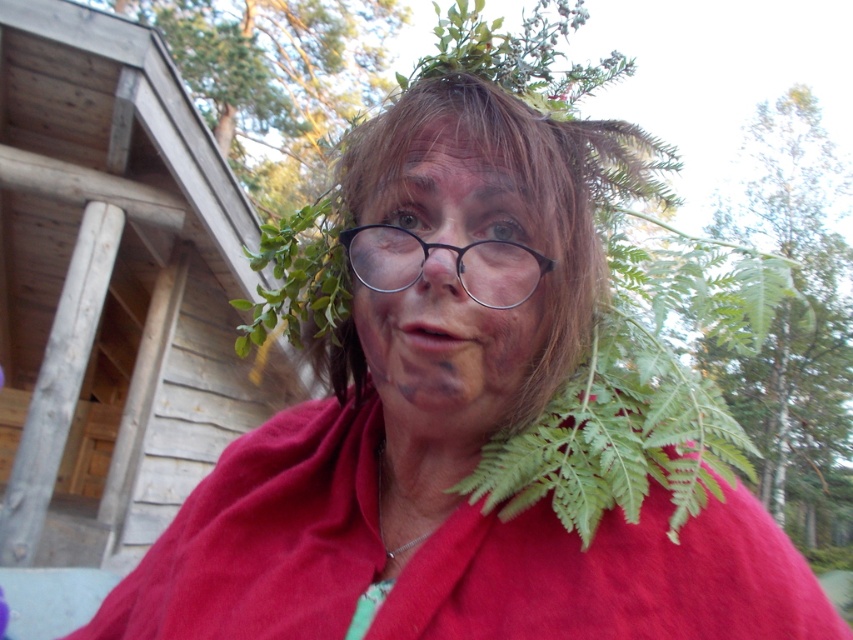
Question: Which point is farther to the camera?

Choices:
 (A) (351, 257)
 (B) (404, 365)

Answer: (A)

Question: Does matte black face at center come in front of metallic round glasses at center?

Choices:
 (A) no
 (B) yes

Answer: (B)

Question: Which point is closer to the camera?

Choices:
 (A) (512, 234)
 (B) (354, 230)

Answer: (A)

Question: Does matte black face at center appear over metallic round glasses at center?

Choices:
 (A) yes
 (B) no

Answer: (B)

Question: Does matte black face at center have a larger size compared to metallic round glasses at center?

Choices:
 (A) yes
 (B) no

Answer: (A)